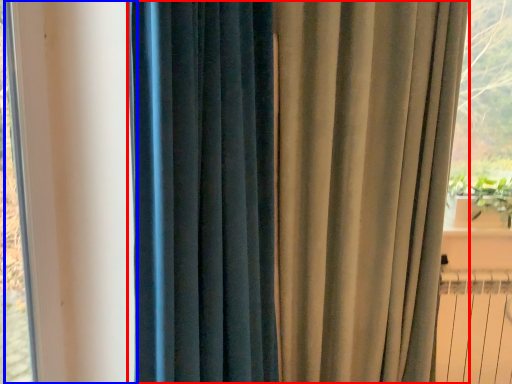
Question: Which of the following is the closest to the observer, curtain (highlighted by a red box) or window frame (highlighted by a blue box)?

Choices:
 (A) curtain
 (B) window frame

Answer: (B)